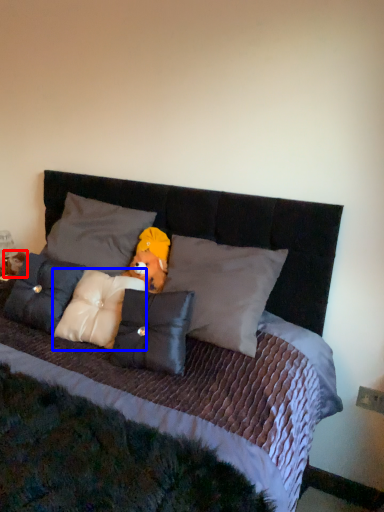
Question: Which point is further to the camera, figurine (highlighted by a red box) or pillow (highlighted by a blue box)?

Choices:
 (A) figurine
 (B) pillow

Answer: (A)